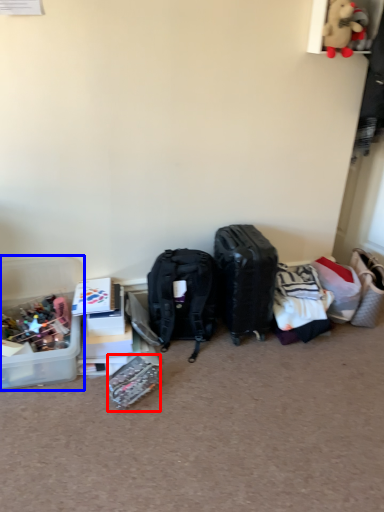
Question: Which object appears closest to the camera in this image, kit (highlighted by a red box) or box (highlighted by a blue box)?

Choices:
 (A) kit
 (B) box

Answer: (A)